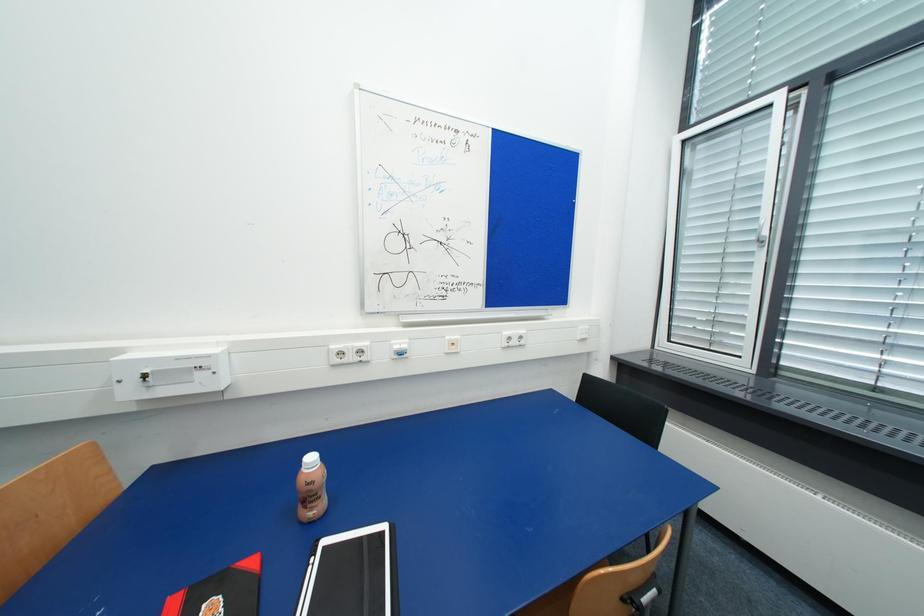
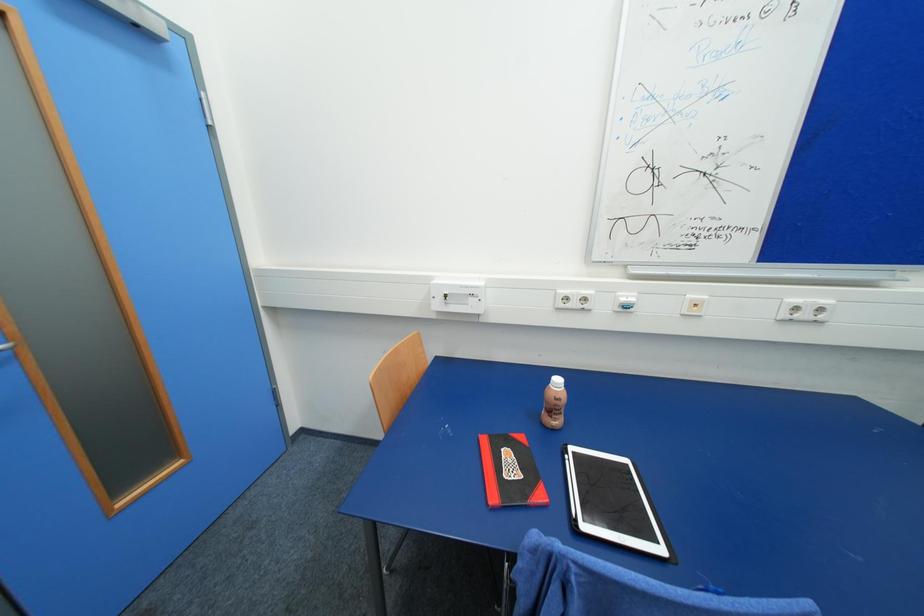
Question: The images are taken continuously from a first-person perspective. In which direction is your viewpoint rotating?

Choices:
 (A) Left
 (B) Right
 (C) Up
 (D) Down

Answer: (A)